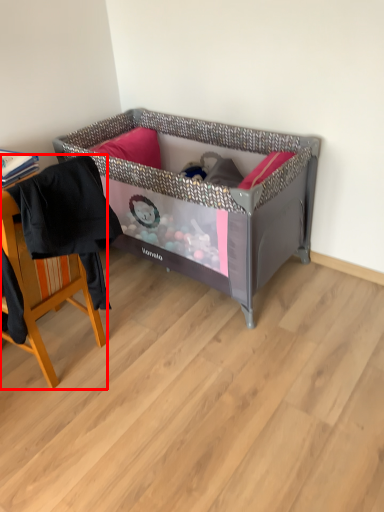
Question: From the image's perspective, where is chair (annotated by the red box) located relative to infant bed?

Choices:
 (A) below
 (B) above

Answer: (A)